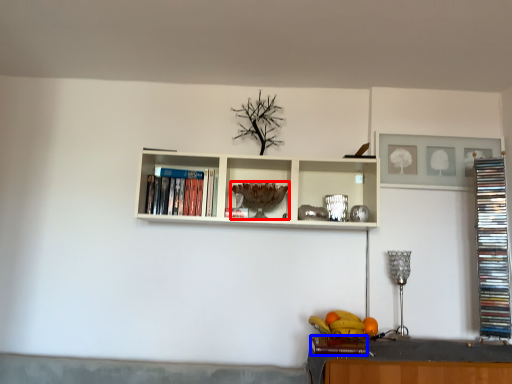
Question: Among these objects, which one is farthest to the camera, wine glass (highlighted by a red box) or book (highlighted by a blue box)?

Choices:
 (A) wine glass
 (B) book

Answer: (A)